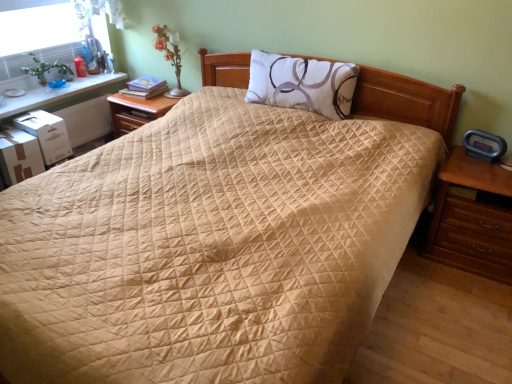
Locate an element on the screen. blank space situated above wooden nightstand at center-left, which ranks as the first nightstand in back-to-front order (from a real-world perspective) is located at coordinates (160, 99).